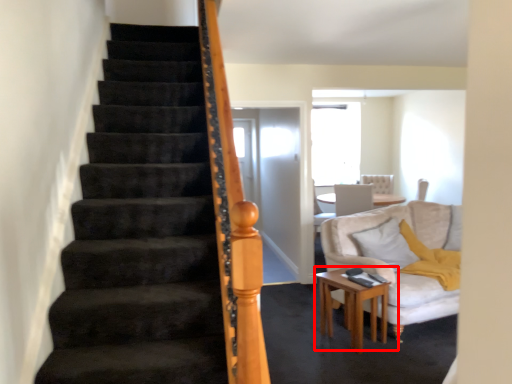
Question: Where is table (annotated by the red box) located in relation to pillow in the image?

Choices:
 (A) right
 (B) left

Answer: (B)